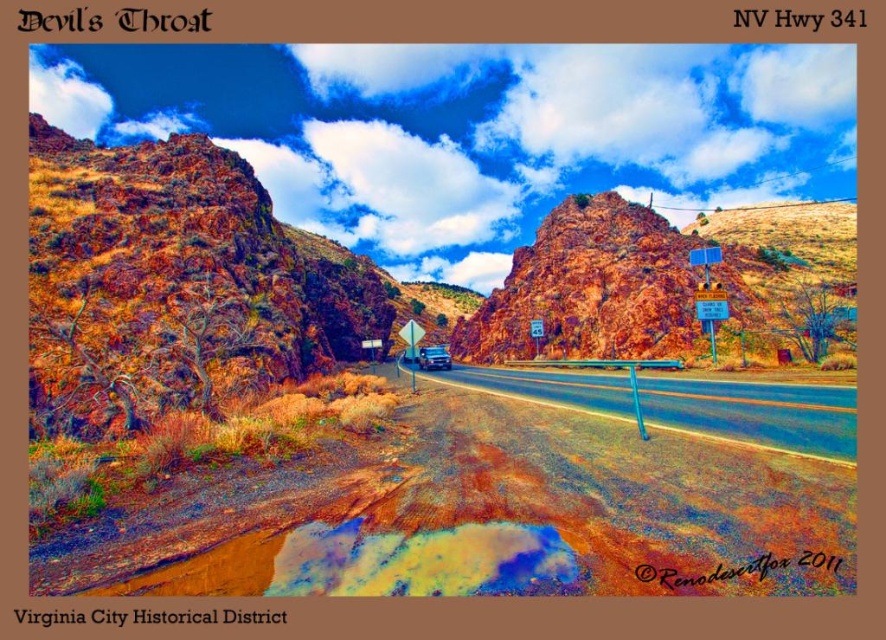
You are driving along Nevada Highway 341 and notice a dried mud path at lower left and a yellow plastic sign at right. Which object is closer to the front of the scene?

The dried mud path at lower left is closer to the front of the scene because it is shorter than the yellow plastic sign at right.

You are a hiker standing at the center of Nevada Highway 341, also known as Devil Throat. You see the rusty rock formation at left in the scene. Can you determine the exact coordinates of this rock formation relative to your current position?

The rusty rock formation at left is located at point (177,284), so its coordinates are 0.445 on the x axis and 0.202 on the y axis relative to your position.

You are driving a metallic silver car at center on Nevada Highway 341. You see a yellow plastic sign at right ahead. Can you see the sign before the car reaches it?

The yellow plastic sign at right is in front of the metallic silver car at center, so yes, you can see the sign before the car reaches it.